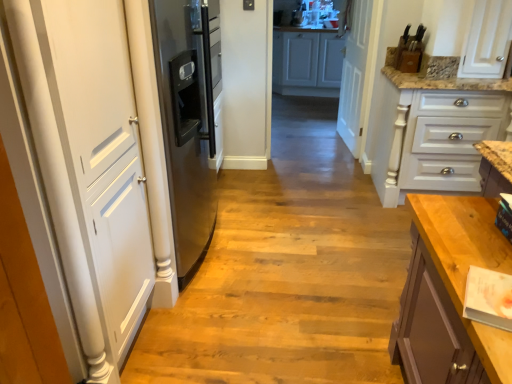
Question: Does wooden floor at center have a lesser height compared to white painted wood drawers at right, the 2th cabinetry viewed from the back?

Choices:
 (A) no
 (B) yes

Answer: (B)

Question: Is white painted wood drawers at right, the 2th cabinetry viewed from the back, at the back of wooden floor at center?

Choices:
 (A) no
 (B) yes

Answer: (A)

Question: Considering the relative positions of wooden floor at center and white painted wood drawers at right, the 2th cabinetry positioned from the top, in the image provided, is wooden floor at center to the right of white painted wood drawers at right, the 2th cabinetry positioned from the top, from the viewer's perspective?

Choices:
 (A) no
 (B) yes

Answer: (A)

Question: From the image's perspective, is wooden floor at center above white painted wood drawers at right, the 2th cabinetry viewed from the back?

Choices:
 (A) yes
 (B) no

Answer: (B)

Question: Can you confirm if wooden floor at center is wider than white painted wood drawers at right, the 2th cabinetry positioned from the top?

Choices:
 (A) no
 (B) yes

Answer: (B)

Question: Considering the positions of white matte cabinet at center, the first cabinetry from the back, and white matte door at left, which ranks as the second door in back-to-front order, in the image, is white matte cabinet at center, the first cabinetry from the back, taller or shorter than white matte door at left, which ranks as the second door in back-to-front order,?

Choices:
 (A) tall
 (B) short

Answer: (B)

Question: Considering the relative positions of white matte cabinet at center, the first cabinetry from the back, and white matte door at left, the 1th door viewed from the left, in the image provided, is white matte cabinet at center, the first cabinetry from the back, to the left or to the right of white matte door at left, the 1th door viewed from the left,?

Choices:
 (A) right
 (B) left

Answer: (A)

Question: Is point (335, 24) closer or farther from the camera than point (84, 152)?

Choices:
 (A) farther
 (B) closer

Answer: (A)

Question: From the image's perspective, relative to white matte door at left, the first door viewed from the front, is white matte cabinet at center, marked as the 2th cabinetry in a front-to-back arrangement, above or below?

Choices:
 (A) above
 (B) below

Answer: (A)

Question: In terms of size, does wooden floor at center appear bigger or smaller than white matte cabinet at center, marked as the 2th cabinetry in a front-to-back arrangement?

Choices:
 (A) small
 (B) big

Answer: (A)

Question: Would you say wooden floor at center is inside or outside white matte cabinet at center, the first cabinetry from the back?

Choices:
 (A) inside
 (B) outside

Answer: (B)

Question: From the image's perspective, is wooden floor at center located above or below white matte cabinet at center, which appears as the first cabinetry when viewed from the top?

Choices:
 (A) below
 (B) above

Answer: (A)

Question: From a real-world perspective, is wooden floor at center positioned above or below white matte cabinet at center, the second cabinetry ordered from the bottom?

Choices:
 (A) above
 (B) below

Answer: (B)

Question: Would you say white painted wood drawers at right, which is the first cabinetry in front-to-back order, is to the left or to the right of white wood door at center, which is the first door from right to left, in the picture?

Choices:
 (A) left
 (B) right

Answer: (B)

Question: In terms of width, does white painted wood drawers at right, the 2th cabinetry viewed from the back, look wider or thinner when compared to white wood door at center, which is the 2th door in left-to-right order?

Choices:
 (A) wide
 (B) thin

Answer: (A)